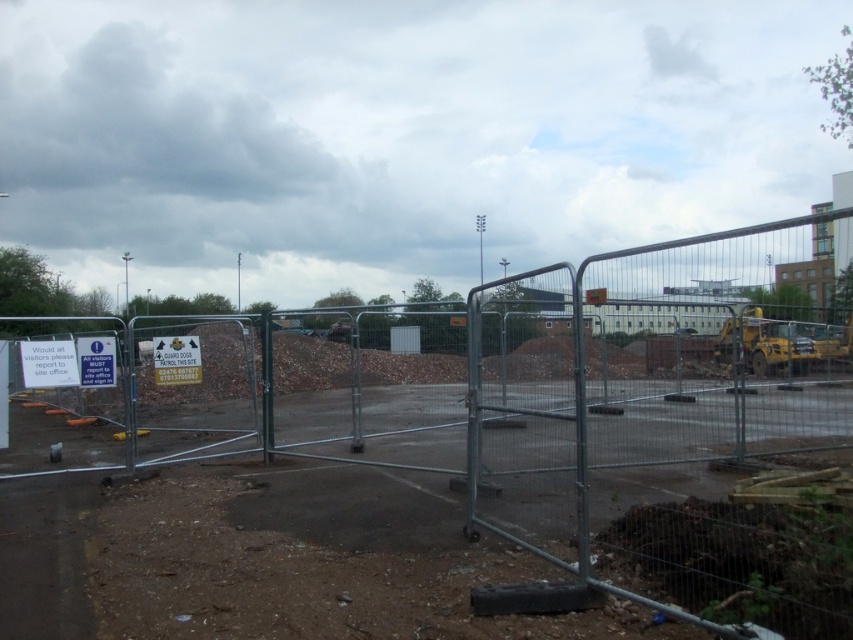
You are a construction worker arriving at the site. You see the metal fence at center marked by point (468, 452). Where should you go to sign in?

The metal fence at center marked by point (468, 452) has a sign stating that all workers must report to the site office to sign in.